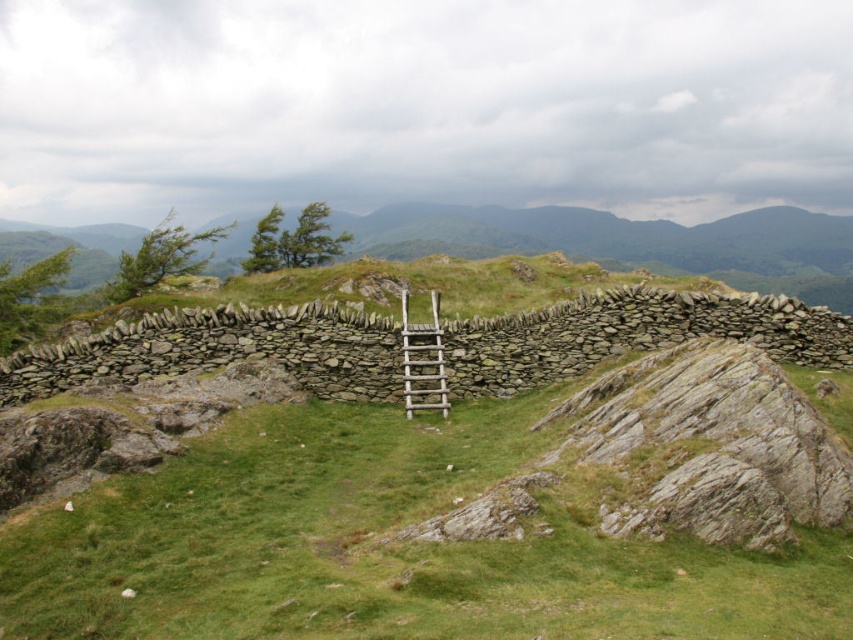
You are standing at the point marked as point (445, 529) in the image. What type of terrain are you currently standing on?

You are standing on green grassy at center.